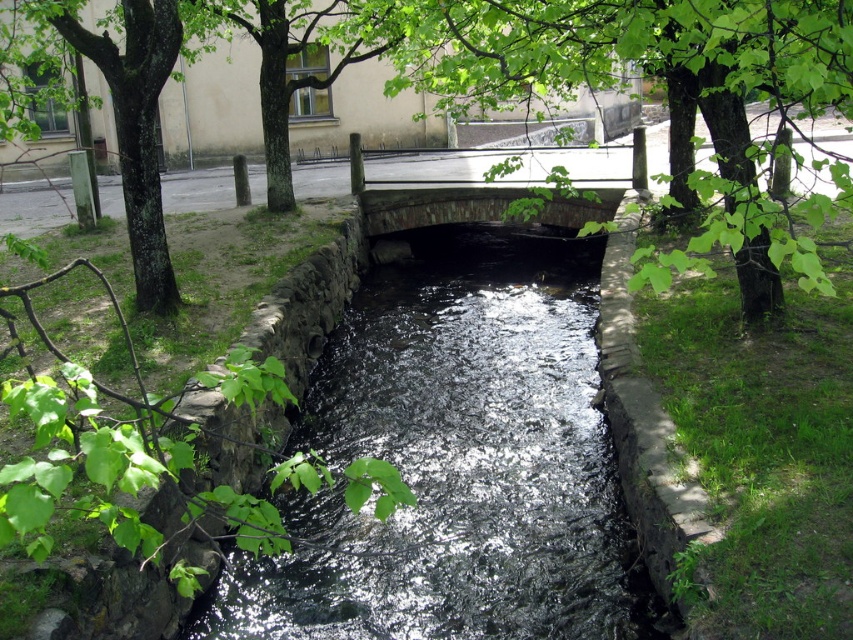
Looking at this image, you are standing at the origin point of the image. Which direction should you move to reach the green leafy tree at center?

The green leafy tree at center is located at point (647, 72), so you should move to the right and up from the origin point to reach it.

You are a hiker planning to cross the stone bridge at center. Before stepping onto it, you notice the shiny dark water at center below. From your position on the bridge, which object would you see first if you look straight down?

The shiny dark water at center is in front of the stone bridge at center, so when looking straight down from the bridge, you would see the shiny dark water at center first because it is closer to the viewer than the bridge structure itself.